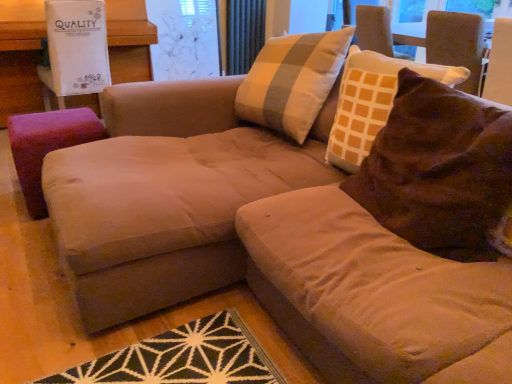
The width and height of the screenshot is (512, 384). What do you see at coordinates (20, 57) in the screenshot? I see `pink fabric ottoman at left` at bounding box center [20, 57].

Describe the element at coordinates (184, 39) in the screenshot. I see `transparent plastic screen at upper center` at that location.

Locate an element on the screen. purple fabric stool at left is located at coordinates (47, 146).

Which is in front, purple fabric stool at left or transparent plastic screen at upper center?

purple fabric stool at left is more forward.

From the image's perspective, who appears lower, purple fabric stool at left or transparent plastic screen at upper center?

From the image's view, purple fabric stool at left is below.

From their relative heights in the image, would you say purple fabric stool at left is taller or shorter than transparent plastic screen at upper center?

Clearly, purple fabric stool at left is shorter compared to transparent plastic screen at upper center.

Is point (78, 125) farther from camera compared to point (174, 2)?

That is False.

Is point (233, 43) closer to viewer compared to point (5, 94)?

That is False.

Is dark gray metallic radiator at upper center aimed at pink fabric ottoman at left?

No.

Are dark gray metallic radiator at upper center and pink fabric ottoman at left located far from each other?

Yes, dark gray metallic radiator at upper center and pink fabric ottoman at left are quite far apart.

Could you tell me if suede beige couch at center is turned towards purple fabric stool at left?

No, suede beige couch at center is not facing towards purple fabric stool at left.

Based on the photo, from a real-world perspective, is suede beige couch at center physically located above or below purple fabric stool at left?

Clearly, from a real-world perspective, suede beige couch at center is above purple fabric stool at left.

Between suede beige couch at center and purple fabric stool at left, which one has larger size?

With larger size is suede beige couch at center.

From the image's perspective, which is below, brown velvety throw pillow at upper right or purple fabric stool at left?

brown velvety throw pillow at upper right, from the image's perspective.

What's the angular difference between brown velvety throw pillow at upper right and purple fabric stool at left's facing directions?

The angular difference between brown velvety throw pillow at upper right and purple fabric stool at left is 88.9 degrees.

Can you confirm if brown velvety throw pillow at upper right is positioned to the left of purple fabric stool at left?

Incorrect, brown velvety throw pillow at upper right is not on the left side of purple fabric stool at left.

Is point (384, 156) closer to viewer compared to point (36, 185)?

Yes, point (384, 156) is in front of point (36, 185).

From a real-world perspective, is brown velvety throw pillow at upper right above or below transparent plastic screen at upper center?

Clearly, from a real-world perspective, brown velvety throw pillow at upper right is above transparent plastic screen at upper center.

Is point (405, 106) closer or farther from the camera than point (175, 46)?

Point (405, 106) is positioned closer to the camera compared to point (175, 46).

Based on their positions, is brown velvety throw pillow at upper right located to the left or right of transparent plastic screen at upper center?

brown velvety throw pillow at upper right is to the right of transparent plastic screen at upper center.

Is brown velvety throw pillow at upper right oriented towards suede beige couch at center?

Yes, brown velvety throw pillow at upper right is oriented towards suede beige couch at center.

Can you tell me how much brown velvety throw pillow at upper right and suede beige couch at center differ in facing direction?

1.03 degrees.

Which is farther from the camera, (502, 144) or (340, 277)?

The point (502, 144) is more distant.

Is transparent plastic screen at upper center completely or partially outside of dark gray metallic radiator at upper center?

transparent plastic screen at upper center lies outside dark gray metallic radiator at upper center's area.

This screenshot has width=512, height=384. I want to click on window screen in front of the dark gray metallic radiator at upper center, so click(x=184, y=39).

Could you tell me if transparent plastic screen at upper center is turned towards dark gray metallic radiator at upper center?

No, transparent plastic screen at upper center is not facing towards dark gray metallic radiator at upper center.

What's the angular difference between transparent plastic screen at upper center and dark gray metallic radiator at upper center's facing directions?

The facing directions of transparent plastic screen at upper center and dark gray metallic radiator at upper center are 1.11 degrees apart.

At what (x,y) coordinates should I click in order to perform the action: click on stool lying in front of the transparent plastic screen at upper center. Please return your answer as a coordinate pair (x, y). This screenshot has width=512, height=384. Looking at the image, I should click on (47, 146).

Identify the location of table below the dark gray metallic radiator at upper center (from the image's perspective). The image size is (512, 384). point(20,57).

From the picture: Looking at the image, which one is located closer to dark gray metallic radiator at upper center, pink fabric ottoman at left or purple fabric stool at left?

pink fabric ottoman at left is closer to dark gray metallic radiator at upper center.

Based on their spatial positions, is dark gray metallic radiator at upper center or purple fabric stool at left closer to transparent plastic screen at upper center?

dark gray metallic radiator at upper center is positioned closer to the anchor transparent plastic screen at upper center.

Consider the image. Estimate the real-world distances between objects in this image. Which object is further from dark gray metallic radiator at upper center, transparent plastic screen at upper center or pink fabric ottoman at left?

pink fabric ottoman at left lies further to dark gray metallic radiator at upper center than the other object.

When comparing their distances from suede beige couch at center, does brown velvety throw pillow at upper right or transparent plastic screen at upper center seem closer?

The object closer to suede beige couch at center is brown velvety throw pillow at upper right.

From the image, which object appears to be nearer to brown velvety throw pillow at upper right, purple fabric stool at left or suede beige couch at center?

Based on the image, suede beige couch at center appears to be nearer to brown velvety throw pillow at upper right.

Estimate the real-world distances between objects in this image. Which object is closer to purple fabric stool at left, brown velvety throw pillow at upper right or transparent plastic screen at upper center?

brown velvety throw pillow at upper right is closer to purple fabric stool at left.

Based on their spatial positions, is suede beige couch at center or pink fabric ottoman at left closer to dark gray metallic radiator at upper center?

pink fabric ottoman at left is closer to dark gray metallic radiator at upper center.

Estimate the real-world distances between objects in this image. Which object is closer to transparent plastic screen at upper center, brown velvety throw pillow at upper right or dark gray metallic radiator at upper center?

dark gray metallic radiator at upper center.

This screenshot has width=512, height=384. I want to click on table between suede beige couch at center and dark gray metallic radiator at upper center along the z-axis, so click(20, 57).

You are a GUI agent. You are given a task and a screenshot of the screen. Output one action in this format:
    pyautogui.click(x=<x>, y=<y>)
    Task: Click on the stool positioned between suede beige couch at center and transparent plastic screen at upper center from near to far
    
    Given the screenshot: What is the action you would take?
    pyautogui.click(x=47, y=146)

Find the location of a particular element. This screenshot has width=512, height=384. window screen positioned between suede beige couch at center and dark gray metallic radiator at upper center from near to far is located at coordinates click(x=184, y=39).

Find the location of `window screen between brown velvety throw pillow at upper right and dark gray metallic radiator at upper center in the front-back direction`. window screen between brown velvety throw pillow at upper right and dark gray metallic radiator at upper center in the front-back direction is located at coordinates (184, 39).